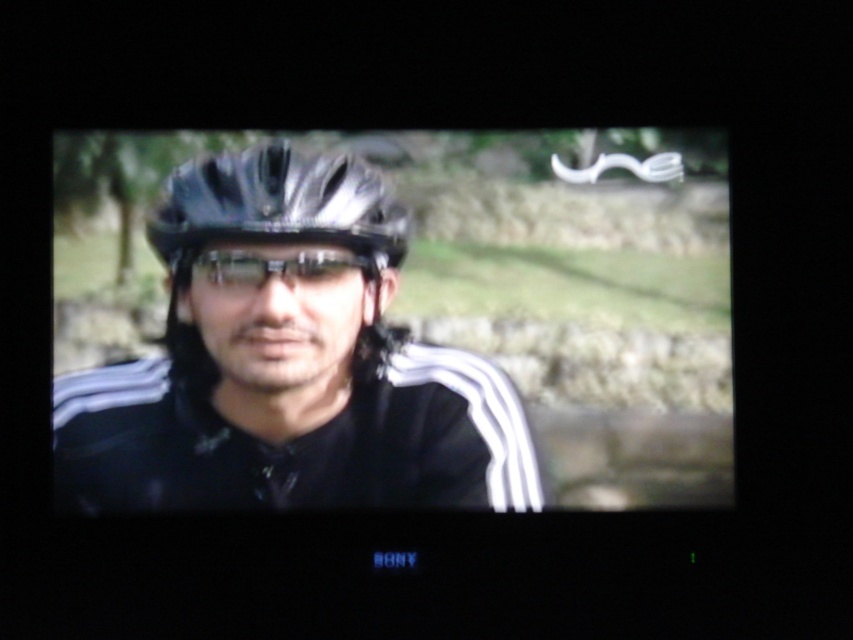
Question: Which of the following is the closest to the observer?

Choices:
 (A) black matte helmet at center
 (B) matte black helmet at center

Answer: (B)

Question: Which point appears farthest from the camera in this image?

Choices:
 (A) (219, 422)
 (B) (221, 250)
 (C) (177, 275)

Answer: (B)

Question: Can you confirm if black matte helmet at center is positioned to the left of transparent plastic goggles at center?

Choices:
 (A) no
 (B) yes

Answer: (B)

Question: Does matte black helmet at center appear over black matte helmet at center?

Choices:
 (A) no
 (B) yes

Answer: (A)

Question: Among these objects, which one is farthest from the camera?

Choices:
 (A) matte black helmet at center
 (B) black matte helmet at center

Answer: (B)

Question: Is matte black helmet at center above black matte helmet at center?

Choices:
 (A) no
 (B) yes

Answer: (A)